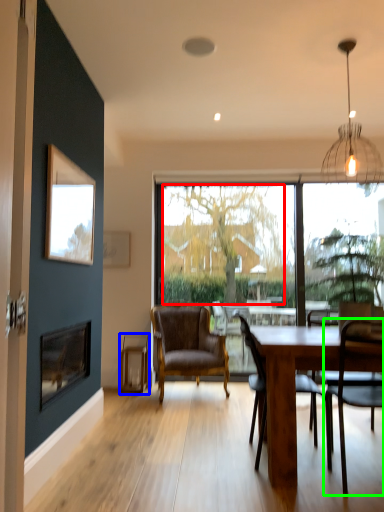
Question: Based on their relative distances, which object is nearer to tree (highlighted by a red box)? Choose from plank (highlighted by a blue box) and chair (highlighted by a green box).

Choices:
 (A) plank
 (B) chair

Answer: (A)